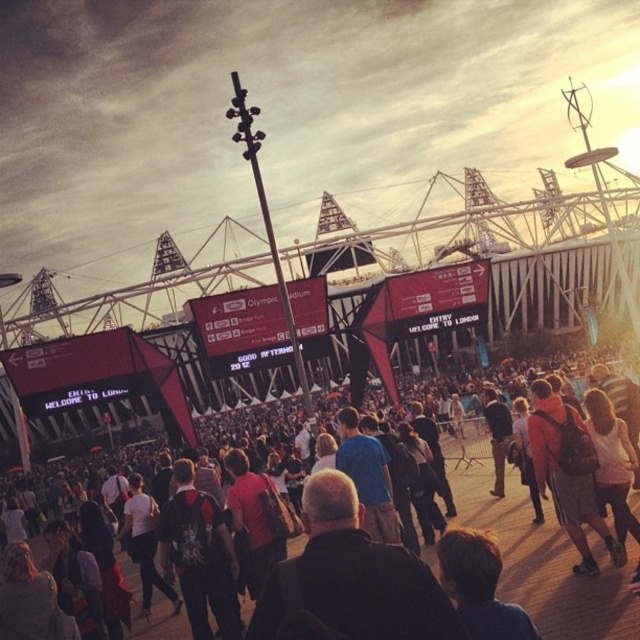
Measure the distance between point (550, 572) and camera.

Point (550, 572) and camera are 403.75 feet apart from each other.

Does matte black crowd at center appear over dark gray backpack at center?

Correct, matte black crowd at center is located above dark gray backpack at center.

Where is `matte black crowd at center`? matte black crowd at center is located at coordinates (545, 561).

This screenshot has height=640, width=640. In order to click on matte black crowd at center in this screenshot , I will do `click(545, 561)`.

Between point (202, 531) and point (579, 417), which one is positioned behind?

Positioned behind is point (579, 417).

Between dark gray backpack at center and matte black backpack at center, which one has less height?

dark gray backpack at center

Does point (216, 538) lie in front of point (573, 452)?

Yes, point (216, 538) is closer to viewer.

I want to click on dark gray backpack at center, so click(198, 556).

Is point (563, 618) less distant than point (563, 404)?

Yes, it is.

Is point (611, 522) positioned in front of point (557, 426)?

Yes, point (611, 522) is closer to viewer.

This screenshot has width=640, height=640. What are the coordinates of `matte black crowd at center` in the screenshot? It's located at (545, 561).